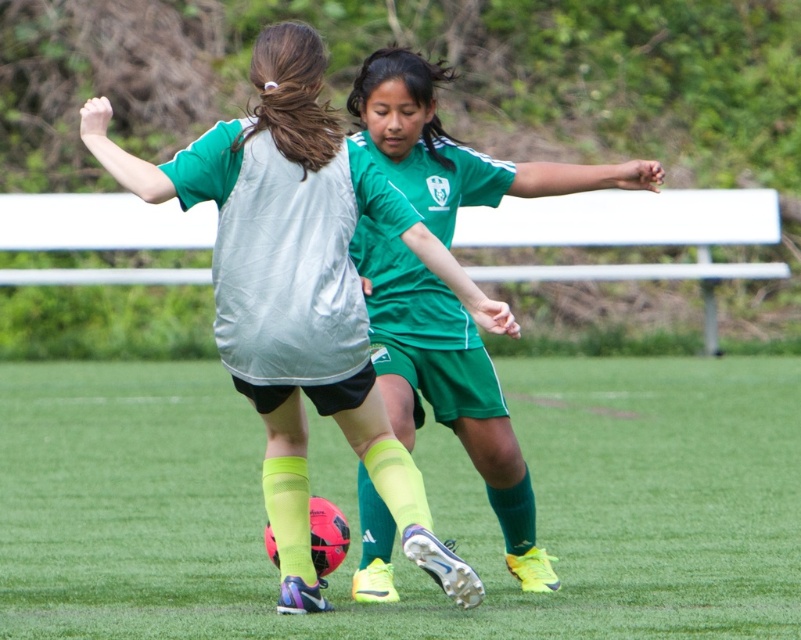
Between matte green jersey at center and green matte jersey at center, which one is positioned higher?

green matte jersey at center is above.

Which of these two, matte green jersey at center or green matte jersey at center, stands taller?

With more height is matte green jersey at center.

What do you see at coordinates (302, 291) in the screenshot?
I see `matte green jersey at center` at bounding box center [302, 291].

Identify the location of matte green jersey at center. The height and width of the screenshot is (640, 801). (302, 291).

Is rubber soccer ball at center to the left of green matte jersey at center from the viewer's perspective?

Yes, rubber soccer ball at center is to the left of green matte jersey at center.

I want to click on rubber soccer ball at center, so click(429, 497).

Find the location of a particular element. rubber soccer ball at center is located at coordinates (429, 497).

Can you confirm if rubber soccer ball at center is positioned to the right of matte green jersey at center?

Correct, you'll find rubber soccer ball at center to the right of matte green jersey at center.

Is point (719, 502) behind point (256, 124)?

Yes, point (719, 502) is farther from viewer.

The image size is (801, 640). What are the coordinates of `rubber soccer ball at center` in the screenshot? It's located at (429, 497).